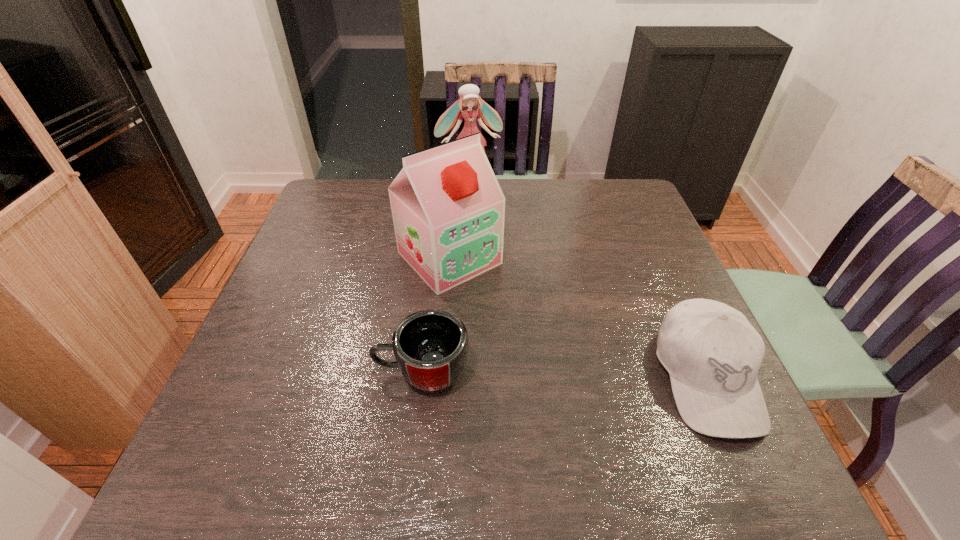
What are the coordinates of `free region at the left edge` in the screenshot? It's located at (296, 254).

Where is `free spot at the right edge of the desktop`? free spot at the right edge of the desktop is located at coordinates (649, 239).

Identify the location of free region at the far left corner of the desktop. (320, 202).

The height and width of the screenshot is (540, 960). I want to click on vacant space at the near left corner, so click(x=285, y=404).

At what (x,y) coordinates should I click in order to perform the action: click on vacant area that lies between the shortest object and the rightmost object. Please return your answer as a coordinate pair (x, y). This screenshot has height=540, width=960. Looking at the image, I should click on (564, 375).

I want to click on vacant area that lies between the baseball cap and the soya milk, so click(x=578, y=318).

In order to click on unoccupied position between the baseball cap and the mug in this screenshot , I will do `click(564, 375)`.

Identify the location of vacant area that lies between the third nearest object and the third tallest object. This screenshot has width=960, height=540. (578, 318).

You are a GUI agent. You are given a task and a screenshot of the screen. Output one action in this format:
    pyautogui.click(x=<x>, y=<y>)
    Task: Click on the free spot between the second shortest object and the farthest object
    
    Given the screenshot: What is the action you would take?
    pyautogui.click(x=588, y=282)

This screenshot has height=540, width=960. What are the coordinates of `free space between the second shortest object and the farthest object` in the screenshot? It's located at (588, 282).